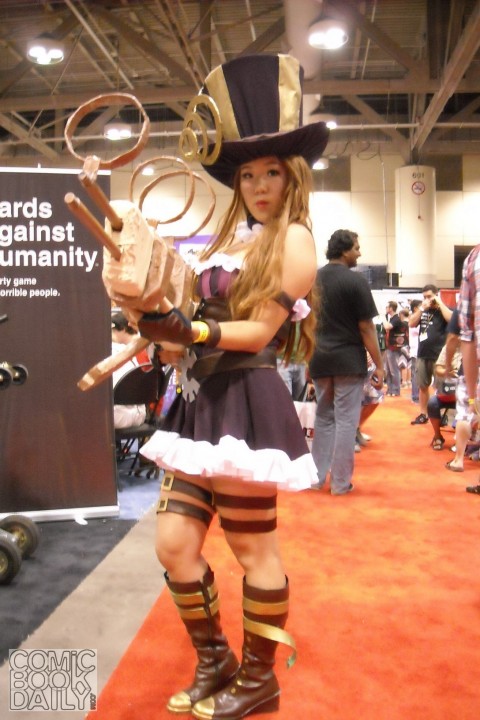
Where is `beige carpet`? The width and height of the screenshot is (480, 720). beige carpet is located at coordinates (101, 615).